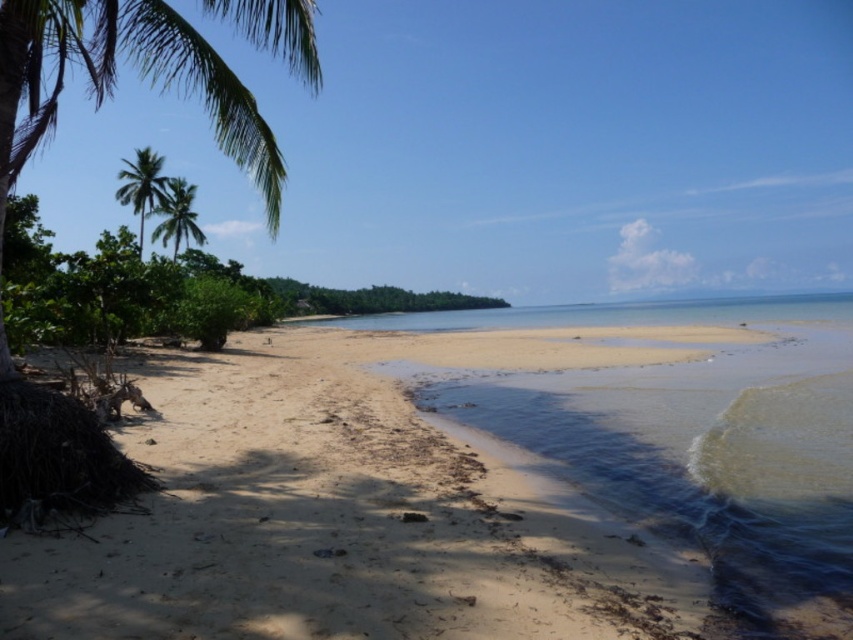
You are standing at the point marked by the coordinates point (469,486) on the sandy beach at lower left. Looking towards the cluster of lush green vegetation on the left side of the image, which direction should you walk to reach the vegetation?

The point (469,486) marks the sandy beach at lower left. Since the vegetation is on the left side of the image, you should walk towards the left to reach the cluster of lush green vegetation.

You are standing on the sandy beach at lower left and want to take a photo of the green leafy palm tree at upper left. Since the palm tree is partially hidden by vegetation, will you need to move forward or backward to get a clearer view of it?

The sandy beach at lower left is in front of the green leafy palm tree at upper left. To get a clearer view of the green leafy palm tree at upper left, you should move backward, as the palm tree is behind the sandy beach where you are standing.